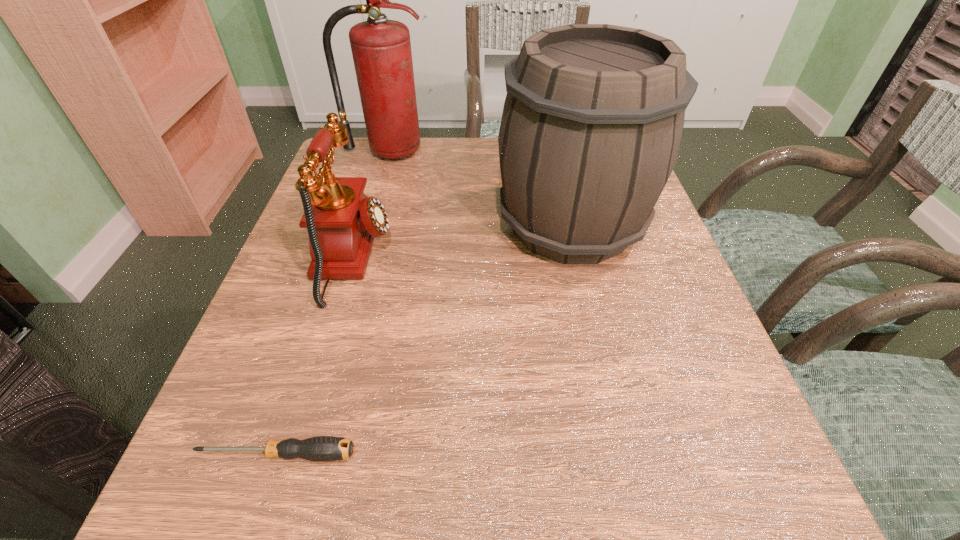
Find the location of a particular element. The width and height of the screenshot is (960, 540). free space between the farthest object and the rightmost object is located at coordinates (479, 188).

Image resolution: width=960 pixels, height=540 pixels. I want to click on vacant space that is in between the wine bucket and the nearest object, so click(424, 340).

At what (x,y) coordinates should I click in order to perform the action: click on object that is the second closest to the rightmost object. Please return your answer as a coordinate pair (x, y). Looking at the image, I should click on (342, 221).

The height and width of the screenshot is (540, 960). In order to click on the second closest object relative to the nearest object in this screenshot , I will do `click(592, 122)`.

At what (x,y) coordinates should I click in order to perform the action: click on free space that satisfies the following two spatial constraints: 1. on the front side of the rightmost object; 2. on the dial of the telephone. Please return your answer as a coordinate pair (x, y). Looking at the image, I should click on (579, 258).

Locate an element on the screen. This screenshot has width=960, height=540. vacant point that satisfies the following two spatial constraints: 1. on the back side of the wine bucket; 2. on the right side of the shortest object is located at coordinates (352, 225).

Locate an element on the screen. This screenshot has width=960, height=540. vacant space that satisfies the following two spatial constraints: 1. at the front of the farthest object where the nozzle is aimed; 2. on the dial of the telephone is located at coordinates (356, 258).

You are a GUI agent. You are given a task and a screenshot of the screen. Output one action in this format:
    pyautogui.click(x=<x>, y=<y>)
    Task: Click on the free location that satisfies the following two spatial constraints: 1. at the front of the farthest object where the nozzle is aimed; 2. on the dial of the telephone
    
    Given the screenshot: What is the action you would take?
    pyautogui.click(x=356, y=258)

The image size is (960, 540). In order to click on vacant space that satisfies the following two spatial constraints: 1. at the front of the rightmost object where the nozzle is aimed; 2. on the left side of the farthest object in this screenshot , I will do `click(366, 225)`.

Where is `vacant region that satisfies the following two spatial constraints: 1. on the back side of the wine bucket; 2. on the left side of the nearest object`? The image size is (960, 540). vacant region that satisfies the following two spatial constraints: 1. on the back side of the wine bucket; 2. on the left side of the nearest object is located at coordinates (352, 225).